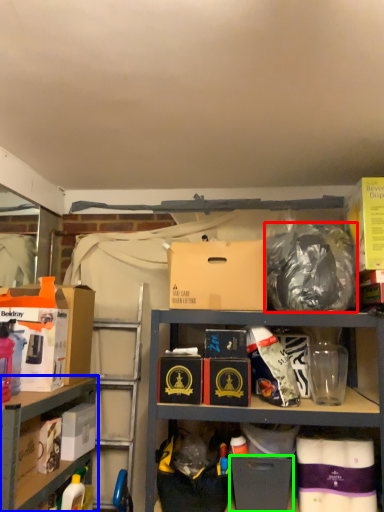
Question: Which is nearer to the garbage (highlighted by a red box)? shelf (highlighted by a blue box) or box (highlighted by a green box).

Choices:
 (A) shelf
 (B) box

Answer: (B)